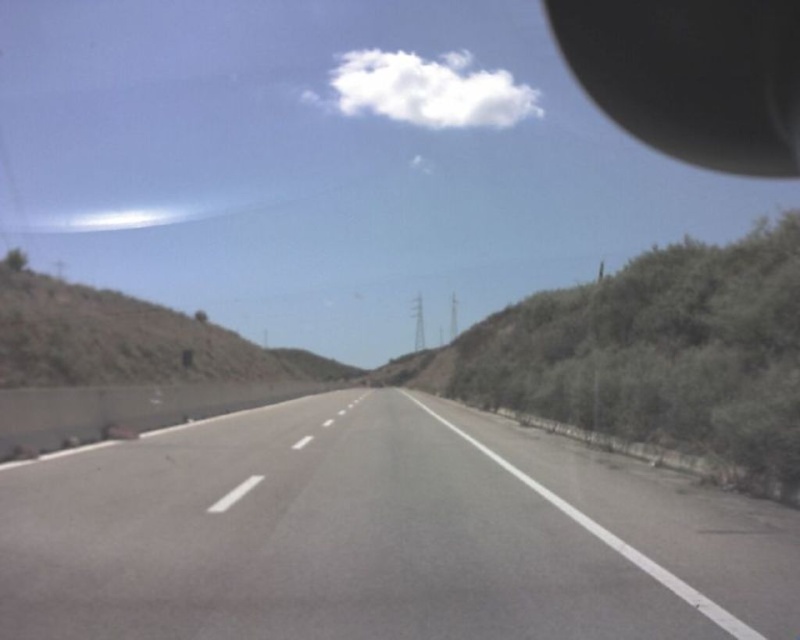
Is black rubber view mirror at upper right wider than dull brown dirt at left?

Yes, black rubber view mirror at upper right is wider than dull brown dirt at left.

Does point (600, 67) come in front of point (32, 353)?

No, it is behind (32, 353).

Locate an element on the screen. black rubber view mirror at upper right is located at coordinates (692, 76).

Does gray asphalt highway at center appear on the right side of black rubber view mirror at upper right?

No, gray asphalt highway at center is not to the right of black rubber view mirror at upper right.

Between gray asphalt highway at center and black rubber view mirror at upper right, which one appears on the left side from the viewer's perspective?

gray asphalt highway at center

Measure the distance between point (x=454, y=593) and camera.

They are 6.15 meters apart.

Locate an element on the screen. gray asphalt highway at center is located at coordinates (380, 536).

What do you see at coordinates (380, 536) in the screenshot? Image resolution: width=800 pixels, height=640 pixels. I see `gray asphalt highway at center` at bounding box center [380, 536].

Who is shorter, gray asphalt highway at center or dull brown dirt at left?

gray asphalt highway at center

Which is behind, point (356, 444) or point (8, 273)?

The point (8, 273) is behind.

Identify the location of gray asphalt highway at center. This screenshot has height=640, width=800. (380, 536).